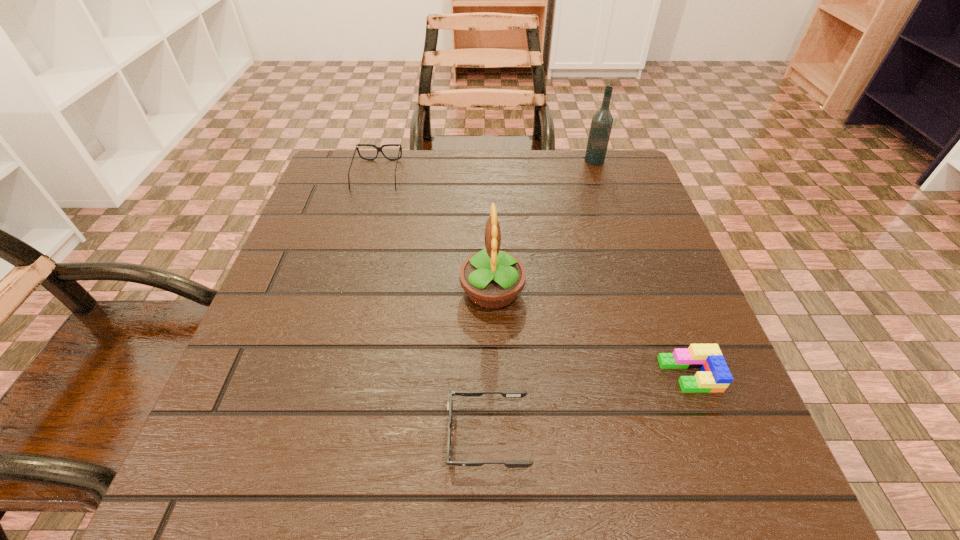
Where is `vodka`? vodka is located at coordinates (601, 125).

Image resolution: width=960 pixels, height=540 pixels. In order to click on the third nearest object in this screenshot , I will do `click(492, 279)`.

Where is `spectacles`? The height and width of the screenshot is (540, 960). spectacles is located at coordinates 379,149.

Find the location of a particular element. The image size is (960, 540). the fourth farthest object is located at coordinates (715, 376).

You are a GUI agent. You are given a task and a screenshot of the screen. Output one action in this format:
    pyautogui.click(x=<x>, y=<y>)
    Task: Click on the shortest object
    
    Given the screenshot: What is the action you would take?
    pyautogui.click(x=506, y=393)

Image resolution: width=960 pixels, height=540 pixels. What are the coordinates of `sunglasses` in the screenshot? It's located at (506, 393).

Identify the location of vacant space situated 0.360m on the front of the vodka. The width and height of the screenshot is (960, 540). (630, 264).

Where is `vacant position located 0.250m on the face of the sunflower`? vacant position located 0.250m on the face of the sunflower is located at coordinates (326, 291).

Where is `vacant space located 0.190m on the face of the sunflower`? The image size is (960, 540). vacant space located 0.190m on the face of the sunflower is located at coordinates (359, 291).

Find the location of `free space located on the face of the sunflower`. free space located on the face of the sunflower is located at coordinates (289, 291).